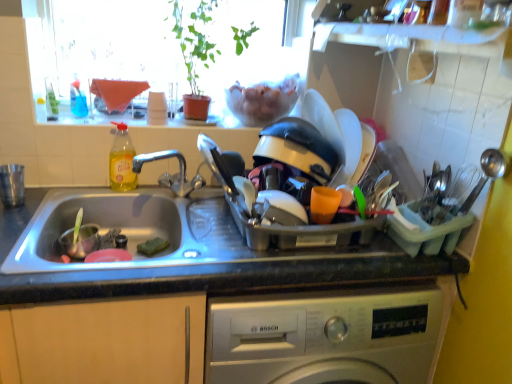
Question: Is granite gray countertop at center completely or partially inside clear glass window sill at upper center?

Choices:
 (A) yes
 (B) no

Answer: (B)

Question: Is clear glass window sill at upper center facing away from granite gray countertop at center?

Choices:
 (A) yes
 (B) no

Answer: (B)

Question: From the image's perspective, is clear glass window sill at upper center located above granite gray countertop at center?

Choices:
 (A) no
 (B) yes

Answer: (B)

Question: Is clear glass window sill at upper center positioned beyond the bounds of granite gray countertop at center?

Choices:
 (A) no
 (B) yes

Answer: (B)

Question: Can you confirm if clear glass window sill at upper center is wider than granite gray countertop at center?

Choices:
 (A) yes
 (B) no

Answer: (B)

Question: In the image, is granite gray countertop at center on the left side or the right side of transparent glass window at upper center?

Choices:
 (A) right
 (B) left

Answer: (A)

Question: From the image's perspective, is granite gray countertop at center located above or below transparent glass window at upper center?

Choices:
 (A) above
 (B) below

Answer: (B)

Question: In terms of height, does granite gray countertop at center look taller or shorter compared to transparent glass window at upper center?

Choices:
 (A) tall
 (B) short

Answer: (B)

Question: From a real-world perspective, relative to transparent glass window at upper center, is granite gray countertop at center vertically above or below?

Choices:
 (A) below
 (B) above

Answer: (A)

Question: Considering the positions of clear glass window sill at upper center and granite gray countertop at center in the image, is clear glass window sill at upper center bigger or smaller than granite gray countertop at center?

Choices:
 (A) small
 (B) big

Answer: (A)

Question: Considering the positions of point (138, 110) and point (77, 342), is point (138, 110) closer or farther from the camera than point (77, 342)?

Choices:
 (A) closer
 (B) farther

Answer: (B)

Question: In terms of width, does clear glass window sill at upper center look wider or thinner when compared to granite gray countertop at center?

Choices:
 (A) thin
 (B) wide

Answer: (A)

Question: From their relative heights in the image, would you say clear glass window sill at upper center is taller or shorter than granite gray countertop at center?

Choices:
 (A) short
 (B) tall

Answer: (A)

Question: Would you say transparent glass window at upper center is inside or outside granite gray countertop at center?

Choices:
 (A) inside
 (B) outside

Answer: (B)

Question: Relative to granite gray countertop at center, is transparent glass window at upper center in front or behind?

Choices:
 (A) behind
 (B) front

Answer: (A)